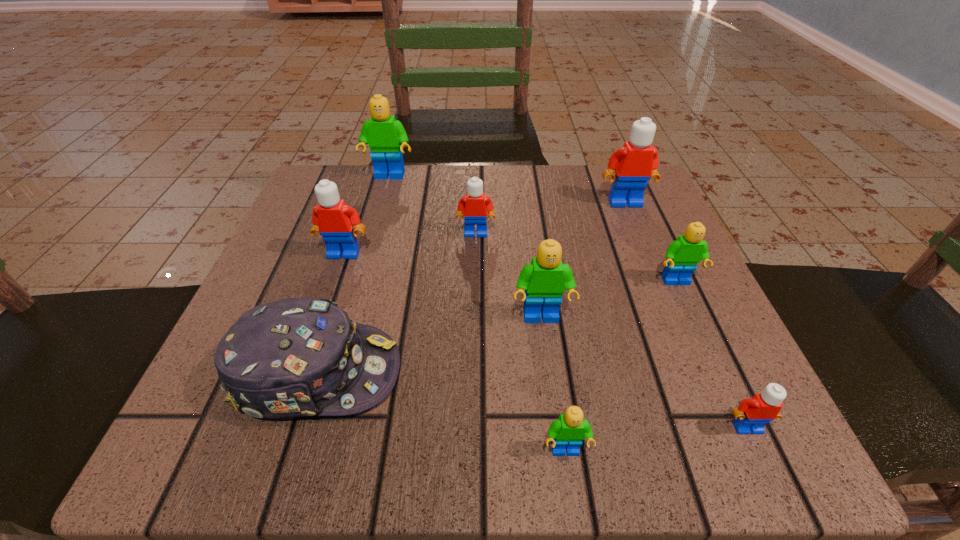
The image size is (960, 540). In order to click on the seventh nearest Lego in this screenshot , I will do `click(635, 163)`.

The width and height of the screenshot is (960, 540). Find the location of `the eighth nearest object`. the eighth nearest object is located at coordinates (635, 163).

Image resolution: width=960 pixels, height=540 pixels. I want to click on the farthest object, so click(x=383, y=133).

Locate an element on the screen. the biggest green Lego is located at coordinates (383, 133).

Identify the location of the third farthest white Lego. The height and width of the screenshot is (540, 960). click(334, 220).

Where is `the fourth farthest object`? The image size is (960, 540). the fourth farthest object is located at coordinates (334, 220).

The image size is (960, 540). Identify the location of the sixth farthest Lego. (544, 280).

Where is `the third farthest green Lego`? This screenshot has height=540, width=960. the third farthest green Lego is located at coordinates tap(544, 280).

Locate an element on the screen. The width and height of the screenshot is (960, 540). the fourth object from left to right is located at coordinates (475, 207).

This screenshot has width=960, height=540. I want to click on the third Lego from left to right, so click(x=475, y=207).